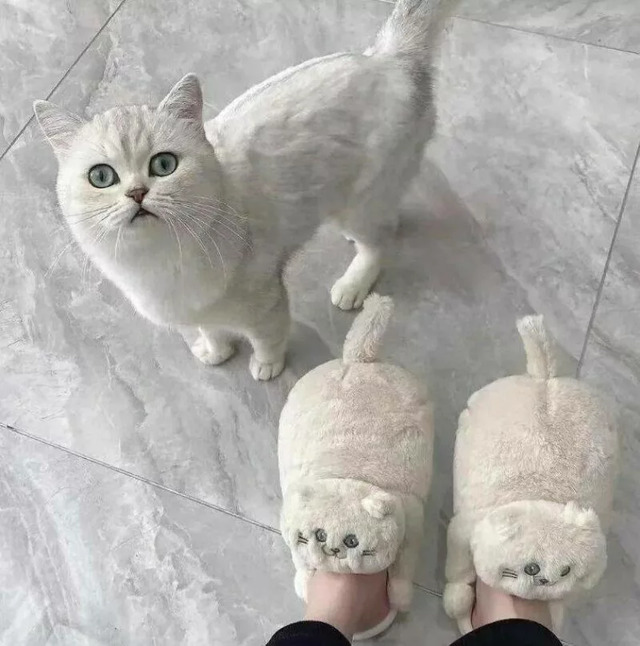
You are a GUI agent. You are given a task and a screenshot of the screen. Output one action in this format:
    pyautogui.click(x=<x>, y=<y>)
    Task: Click on the fake cat ears on slippers
    
    Given the screenshot: What is the action you would take?
    pyautogui.click(x=298, y=492), pyautogui.click(x=374, y=499), pyautogui.click(x=496, y=522), pyautogui.click(x=578, y=506)